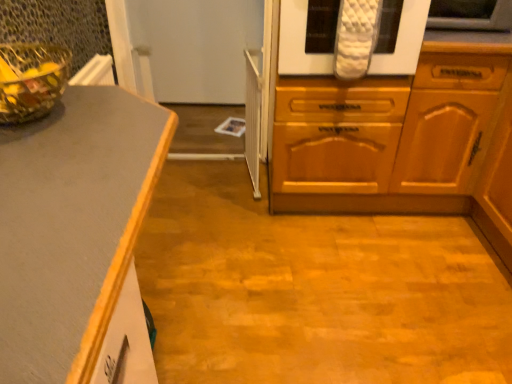
At what (x,y) coordinates should I click in order to perform the action: click on vacant space in front of wooden cabinet at center. Please return your answer as a coordinate pair (x, y). Image resolution: width=512 pixels, height=384 pixels. Looking at the image, I should click on (328, 264).